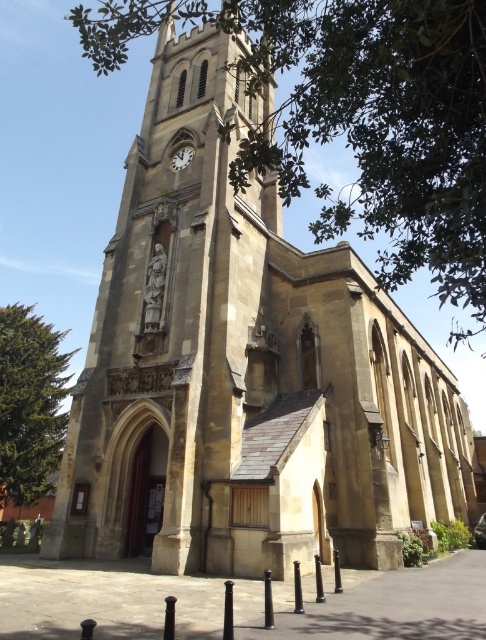
Question: Which point is farther to the camera?

Choices:
 (A) (187, 145)
 (B) (29, 312)

Answer: (B)

Question: Does green leafy tree at left have a lesser width compared to white glossy clock at upper center?

Choices:
 (A) yes
 (B) no

Answer: (B)

Question: Which of the following is the closest to the observer?

Choices:
 (A) green leafy tree at left
 (B) white glossy clock at upper center

Answer: (B)

Question: From the image, what is the correct spatial relationship of green leafy tree at left in relation to white glossy clock at upper center?

Choices:
 (A) left
 (B) right

Answer: (A)

Question: Does green leafy tree at left have a larger size compared to white glossy clock at upper center?

Choices:
 (A) yes
 (B) no

Answer: (A)